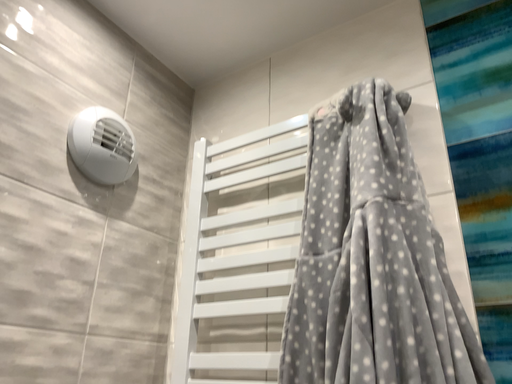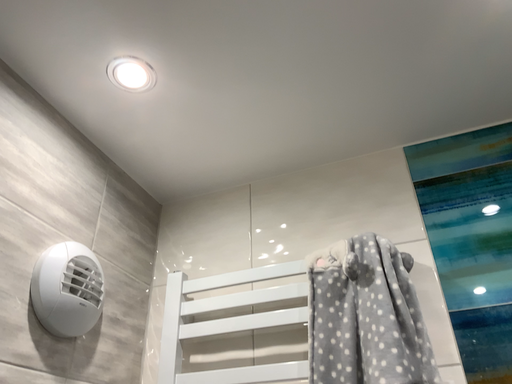
Question: Which way did the camera rotate in the video?

Choices:
 (A) rotated downward
 (B) rotated upward

Answer: (B)